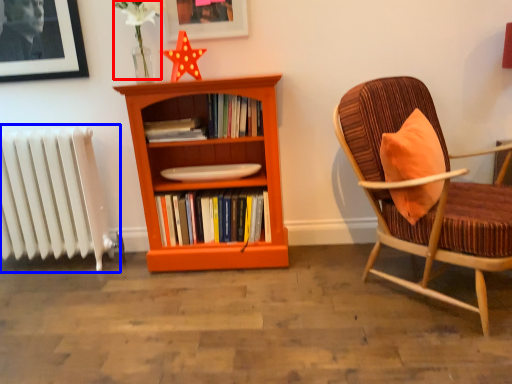
Question: Which object appears closest to the camera in this image, flower (highlighted by a red box) or radiator (highlighted by a blue box)?

Choices:
 (A) flower
 (B) radiator

Answer: (A)